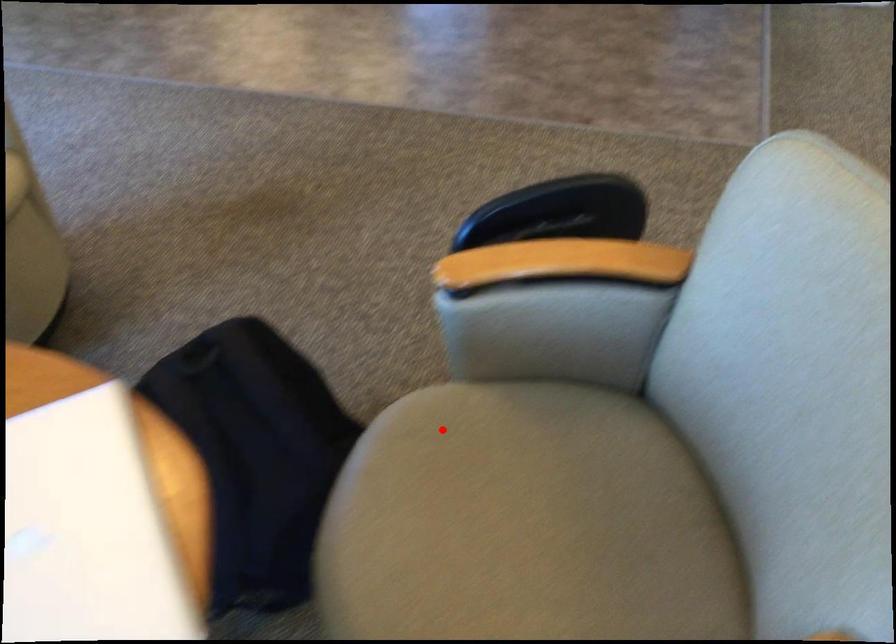
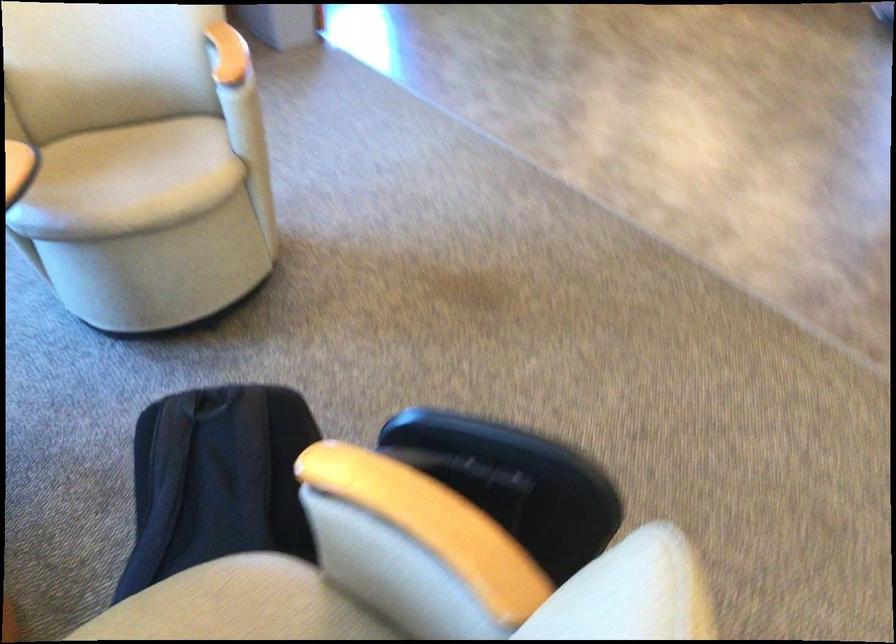
Locate, in the second image, the point that corresponds to the highlighted location in the first image.

(237, 605)